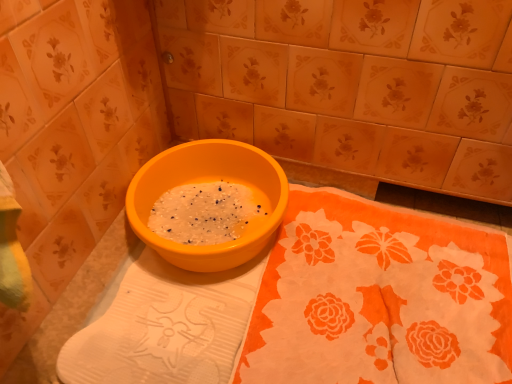
Question: In the image, is orange fabric at center positioned in front of or behind matte ceramic tile at center?

Choices:
 (A) behind
 (B) front

Answer: (B)

Question: From the image's perspective, relative to matte ceramic tile at center, is orange fabric at center above or below?

Choices:
 (A) above
 (B) below

Answer: (B)

Question: Based on their relative distances, which object is nearer to the matte plastic basin at center?

Choices:
 (A) matte ceramic tile at center
 (B) orange fabric at center

Answer: (A)

Question: Based on their relative distances, which object is farther from the matte plastic basin at center?

Choices:
 (A) orange fabric at center
 (B) matte ceramic tile at center

Answer: (A)